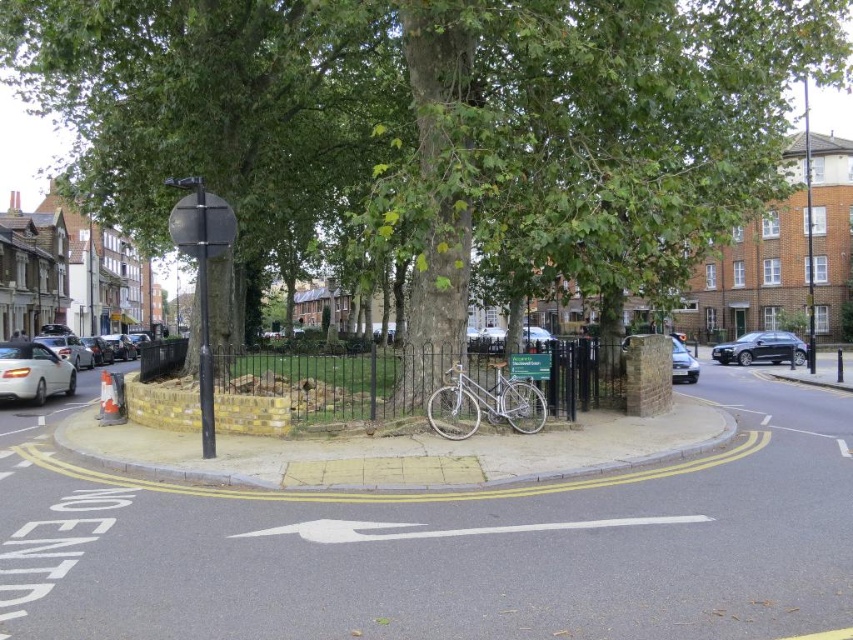
Question: Which point is closer to the camera?

Choices:
 (A) metallic gray sedan at right
 (B) green leafy tree at center

Answer: (B)

Question: Which point is closer to the camera taking this photo?

Choices:
 (A) (3, 360)
 (B) (70, 387)
 (C) (520, 416)
 (D) (698, 369)

Answer: (C)

Question: Is silver metallic car at left positioned at the back of metallic silver car at center?

Choices:
 (A) no
 (B) yes

Answer: (B)

Question: Which object is positioned farthest from the silver metallic car at left?

Choices:
 (A) metallic silver car at center
 (B) white glossy car at left
 (C) green plastic sign at center

Answer: (A)

Question: Can you confirm if silver metallic car at left is wider than green plastic sign at center?

Choices:
 (A) no
 (B) yes

Answer: (B)

Question: Does silver metallic car at left appear under metallic silver car at center?

Choices:
 (A) no
 (B) yes

Answer: (B)